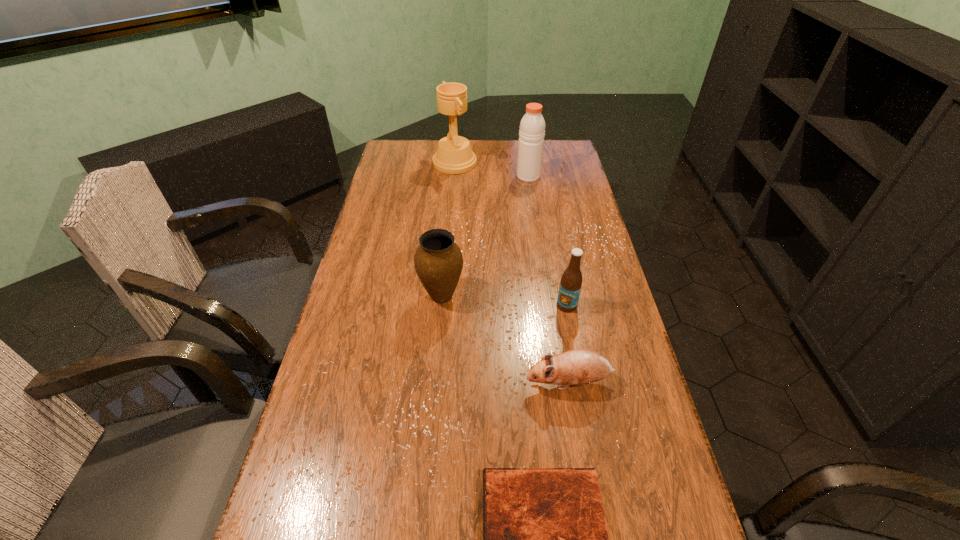
Where is `award`? The height and width of the screenshot is (540, 960). award is located at coordinates (454, 155).

Image resolution: width=960 pixels, height=540 pixels. I want to click on shaker, so click(x=532, y=127).

Image resolution: width=960 pixels, height=540 pixels. I want to click on urn, so click(438, 261).

What are the coordinates of `beer bottle` in the screenshot? It's located at (571, 281).

Where is `hamster`? hamster is located at coordinates (578, 367).

Find the location of `the second shortest object`. the second shortest object is located at coordinates (578, 367).

At what (x,y) coordinates should I click in order to perform the action: click on vacant space located 0.170m on the front of the award. Please return your answer as a coordinate pair (x, y). This screenshot has height=540, width=960. Looking at the image, I should click on (452, 200).

Image resolution: width=960 pixels, height=540 pixels. I want to click on vacant space situated on the left of the shaker, so coord(445,176).

In order to click on free space located 0.140m on the right of the urn in this screenshot , I will do `click(512, 296)`.

At what (x,y) coordinates should I click in order to perform the action: click on free space located on the left of the beer bottle. Please return your answer as a coordinate pair (x, y). The width and height of the screenshot is (960, 540). Looking at the image, I should click on (533, 306).